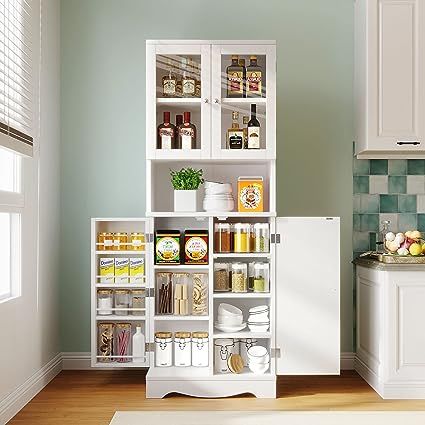
Find the location of a particular element. bottles is located at coordinates (168, 86), (186, 82), (232, 80), (252, 84), (252, 127), (245, 120), (235, 138), (186, 137), (178, 119), (161, 144).